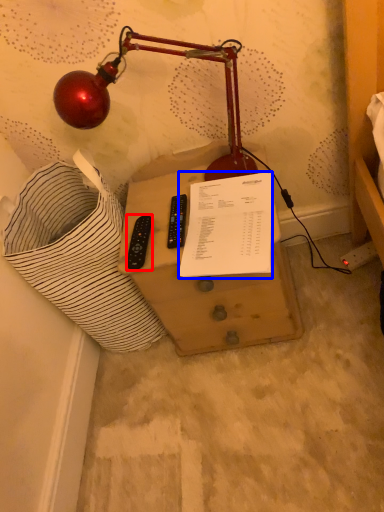
Question: Which object is closer to the camera taking this photo, control (highlighted by a red box) or document (highlighted by a blue box)?

Choices:
 (A) control
 (B) document

Answer: (B)